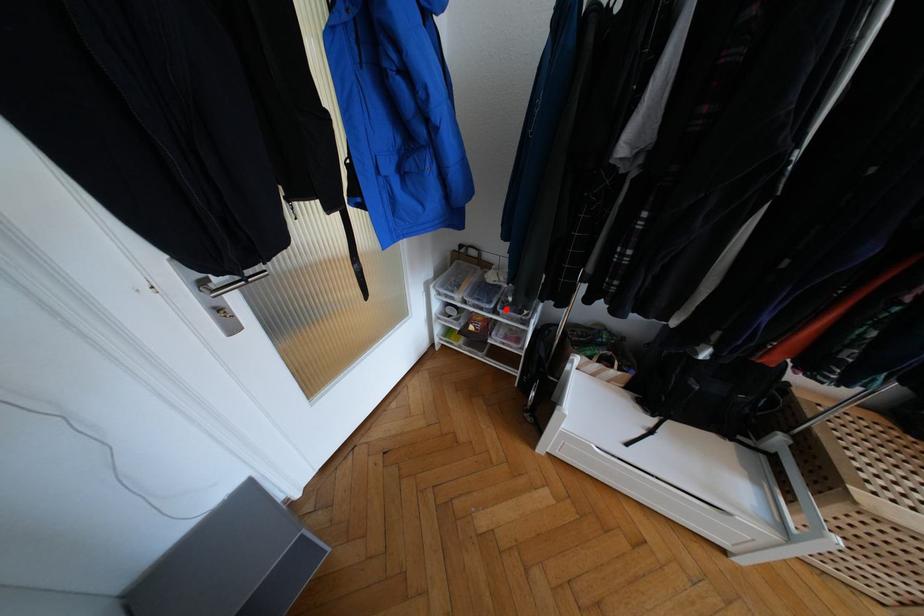
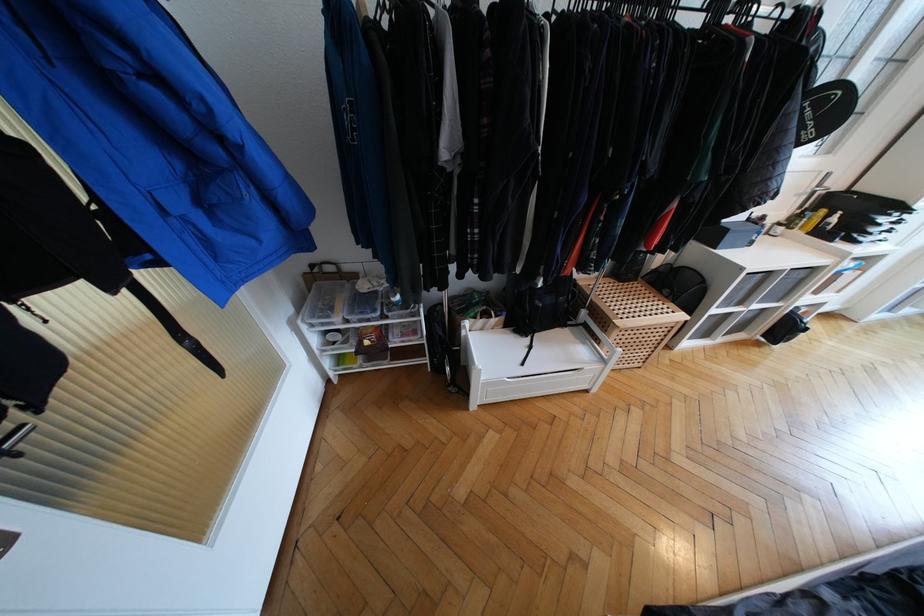
Find the pixel in the second image that matches the highlighted location in the first image.

(393, 312)